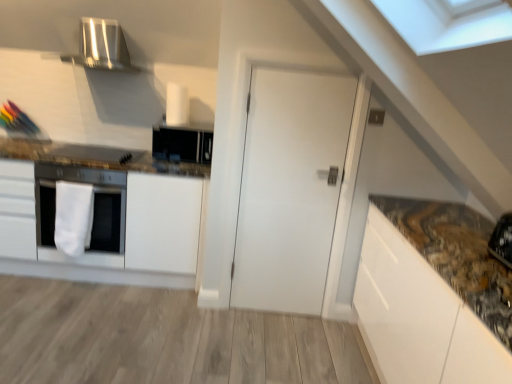
Question: From the image's perspective, is white fabric towel at left above or below white matte cabinet at left?

Choices:
 (A) above
 (B) below

Answer: (B)

Question: Is white fabric towel at left wider or thinner than white matte cabinet at left?

Choices:
 (A) thin
 (B) wide

Answer: (A)

Question: Which of these objects is positioned farthest from the white matte cabinet at left?

Choices:
 (A) satin silver exhaust hood at upper left
 (B) white matte oven at left
 (C) white fabric towel at left
 (D) white matte door at center
 (E) black matte microwave at upper center

Answer: (A)

Question: Which of these objects is positioned closest to the white matte cabinet at left?

Choices:
 (A) white matte door at center
 (B) white matte oven at left
 (C) black matte microwave at upper center
 (D) satin silver exhaust hood at upper left
 (E) white fabric towel at left

Answer: (B)